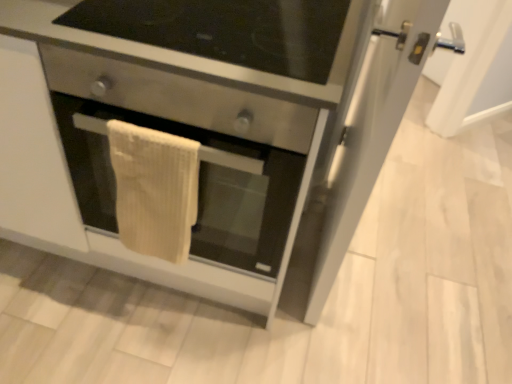
Question: Could you tell me if beige textured towel at center is facing stainless steel oven at center?

Choices:
 (A) yes
 (B) no

Answer: (A)

Question: From a real-world perspective, is beige textured towel at center on top of stainless steel oven at center?

Choices:
 (A) no
 (B) yes

Answer: (B)

Question: Is beige textured towel at center oriented away from stainless steel oven at center?

Choices:
 (A) no
 (B) yes

Answer: (B)

Question: From a real-world perspective, is beige textured towel at center physically below stainless steel oven at center?

Choices:
 (A) yes
 (B) no

Answer: (B)

Question: Would you say beige textured towel at center is outside stainless steel oven at center?

Choices:
 (A) no
 (B) yes

Answer: (A)

Question: Looking at the image, does transparent glass door at right seem bigger or smaller compared to beige textured towel at center?

Choices:
 (A) big
 (B) small

Answer: (A)

Question: Is transparent glass door at right wider or thinner than beige textured towel at center?

Choices:
 (A) thin
 (B) wide

Answer: (B)

Question: Is transparent glass door at right to the left or to the right of beige textured towel at center in the image?

Choices:
 (A) left
 (B) right

Answer: (B)

Question: From a real-world perspective, relative to beige textured towel at center, is transparent glass door at right vertically above or below?

Choices:
 (A) above
 (B) below

Answer: (A)

Question: From a real-world perspective, is beige textured towel at center physically located above or below stainless steel oven at center?

Choices:
 (A) below
 (B) above

Answer: (B)

Question: Does point (163, 246) appear closer or farther from the camera than point (219, 203)?

Choices:
 (A) farther
 (B) closer

Answer: (B)

Question: Considering the relative positions of beige textured towel at center and stainless steel oven at center in the image provided, is beige textured towel at center to the left or to the right of stainless steel oven at center?

Choices:
 (A) left
 (B) right

Answer: (A)

Question: In terms of size, does beige textured towel at center appear bigger or smaller than stainless steel oven at center?

Choices:
 (A) small
 (B) big

Answer: (A)

Question: In the image, is stainless steel drawer at center on the left side or the right side of stainless steel oven at center?

Choices:
 (A) right
 (B) left

Answer: (A)

Question: From a real-world perspective, relative to stainless steel oven at center, is stainless steel drawer at center vertically above or below?

Choices:
 (A) above
 (B) below

Answer: (A)